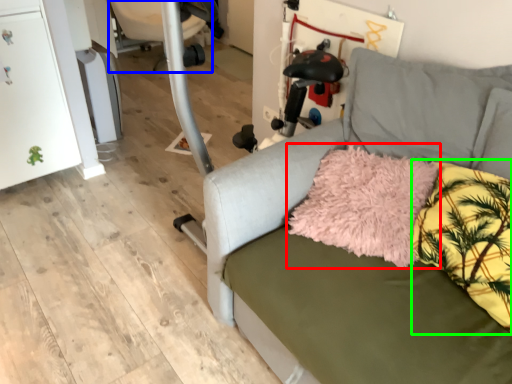
Question: Which object is positioned farthest from throw pillow (highlighted by a red box)? Select from swivel chair (highlighted by a blue box) and pillow (highlighted by a green box).

Choices:
 (A) swivel chair
 (B) pillow

Answer: (A)